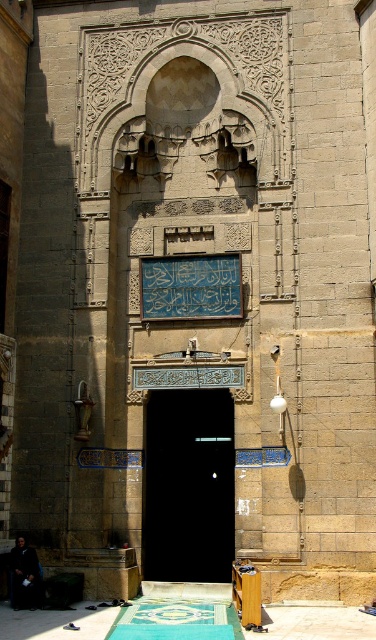
You are a visitor standing in front of the historical building and see the green woven mat at lower center and the dark brown leather jacket at lower left. Which object is closer to the ground?

The green woven mat at lower center is located below dark brown leather jacket at lower left, so it is closer to the ground.

You are standing in front of the historical building with intricate Islamic architecture. You see a point at coordinates [189,486]. What object is located at that point?

The point at coordinates [189,486] indicates the black glass door at center.